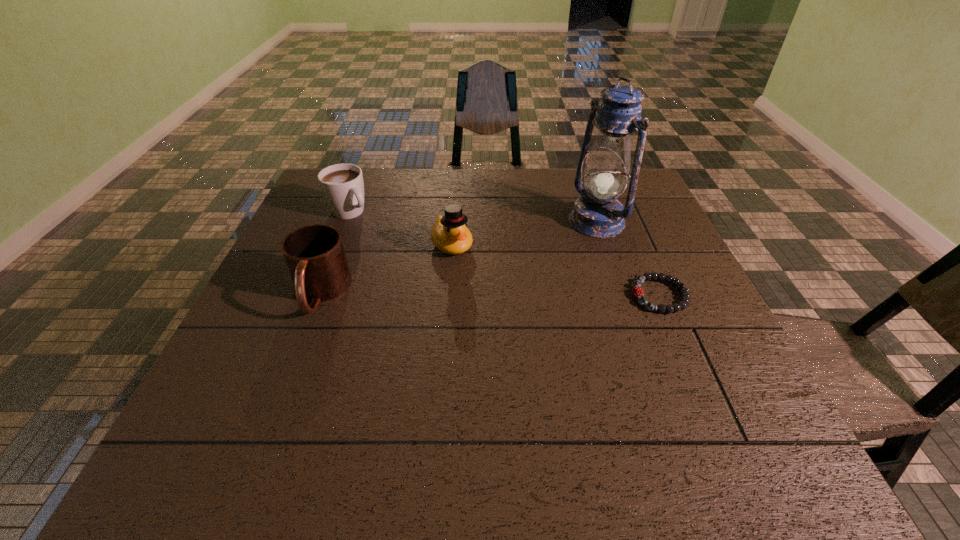
Where is `vacant space located 0.090m on the front-facing side of the duck`? The width and height of the screenshot is (960, 540). vacant space located 0.090m on the front-facing side of the duck is located at coordinates (476, 281).

Where is `free space located on the front-facing side of the duck`? free space located on the front-facing side of the duck is located at coordinates (474, 279).

Find the location of a particular element. The height and width of the screenshot is (540, 960). vacant point located 0.230m on the front-facing side of the duck is located at coordinates (505, 319).

Locate an element on the screen. The image size is (960, 540). free location located 0.390m on the front-facing side of the tallest object is located at coordinates (459, 288).

Identify the location of vacant space located on the front-facing side of the tallest object. The width and height of the screenshot is (960, 540). (483, 276).

Where is `vacant space located 0.380m on the front-facing side of the tallest object`? This screenshot has width=960, height=540. vacant space located 0.380m on the front-facing side of the tallest object is located at coordinates point(463,286).

This screenshot has width=960, height=540. In order to click on cappuccino that is at the far edge in this screenshot , I will do `click(342, 185)`.

The image size is (960, 540). Identify the location of lantern that is at the far edge. (597, 213).

Locate an element on the screen. Image resolution: width=960 pixels, height=540 pixels. mug that is at the left edge is located at coordinates (315, 256).

Identify the location of cappuccino at the left edge. (342, 185).